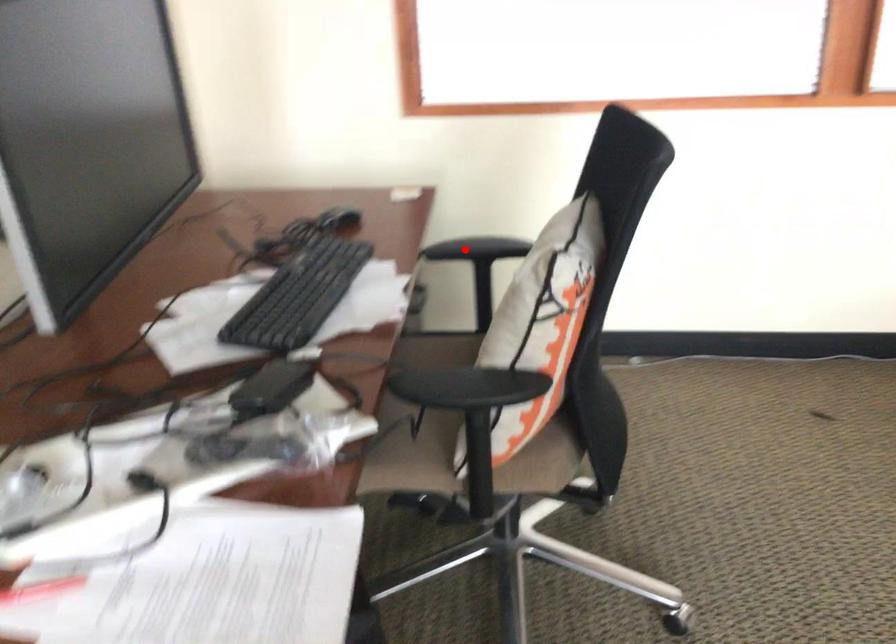
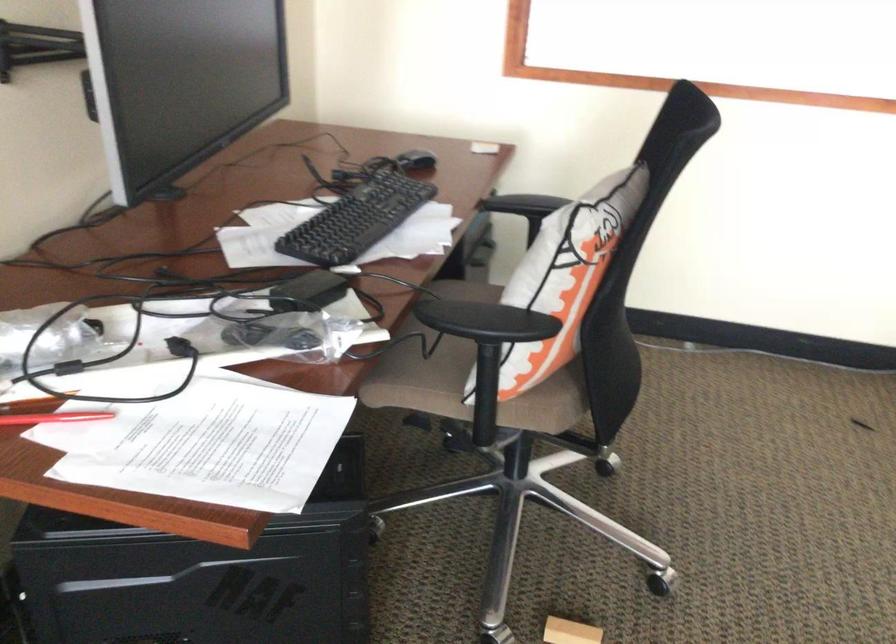
The point at the highlighted location is marked in the first image. Where is the corresponding point in the second image?

(522, 204)